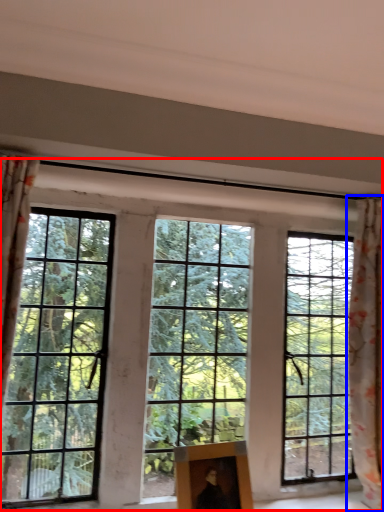
Question: Which of the following is the closest to the observer, window (highlighted by a red box) or curtain (highlighted by a blue box)?

Choices:
 (A) window
 (B) curtain

Answer: (A)